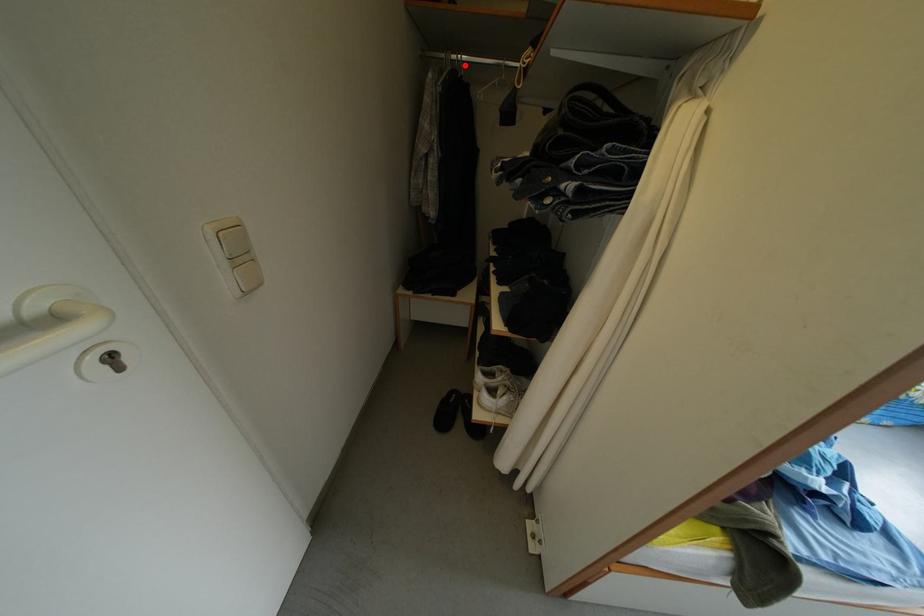
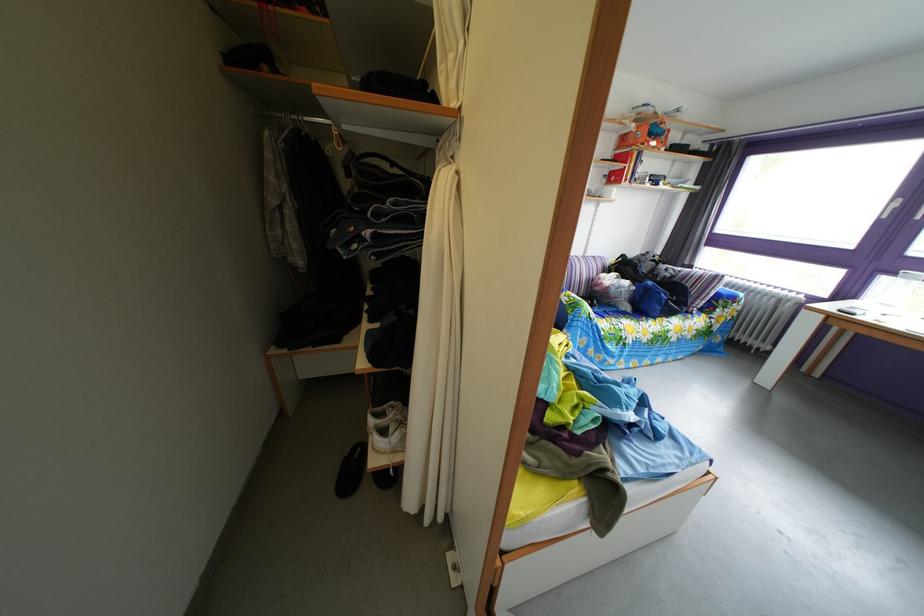
Question: I am providing you with two images of the same scene from different viewpoints. A red point is marked on the first image. Can you still see the location of the red point in image 2?

Choices:
 (A) Yes
 (B) No

Answer: (A)